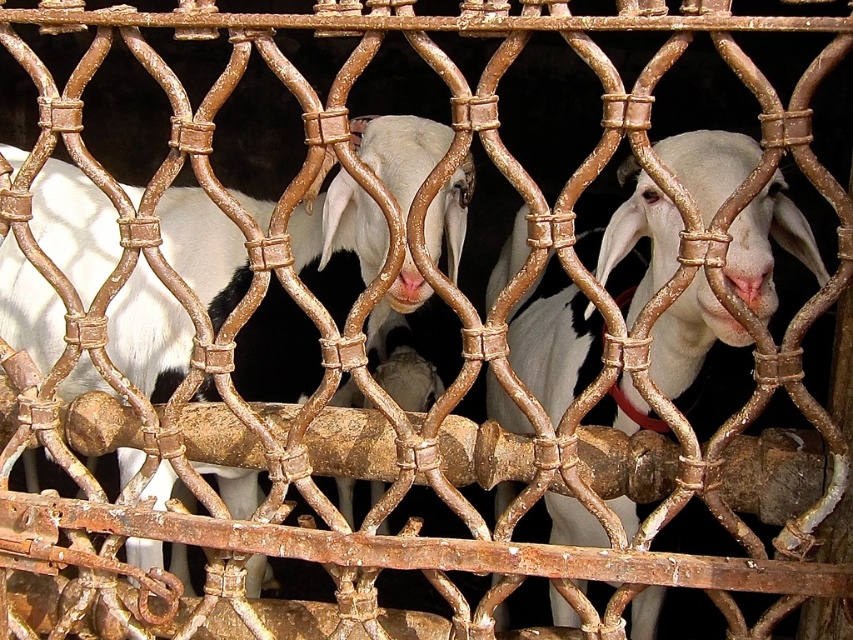
Question: Considering the relative positions of white woolen goat at center and white matte goat at center in the image provided, where is white woolen goat at center located with respect to white matte goat at center?

Choices:
 (A) right
 (B) left

Answer: (B)

Question: Considering the relative positions of white woolen goat at center and white matte goat at center in the image provided, where is white woolen goat at center located with respect to white matte goat at center?

Choices:
 (A) left
 (B) right

Answer: (A)

Question: Among these points, which one is farthest from the camera?

Choices:
 (A) (213, 397)
 (B) (492, 385)

Answer: (B)

Question: Can you confirm if white woolen goat at center is thinner than white matte goat at center?

Choices:
 (A) yes
 (B) no

Answer: (B)